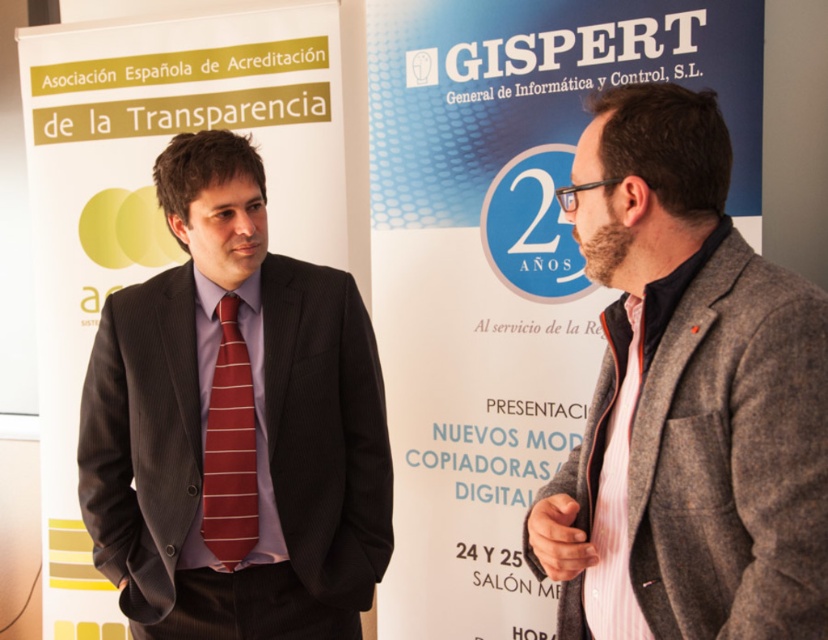
Is matte black suit at left below red striped tie at center?

Incorrect, matte black suit at left is not positioned below red striped tie at center.

Can you confirm if matte black suit at left is positioned above red striped tie at center?

Correct, matte black suit at left is located above red striped tie at center.

In order to click on matte black suit at left in this screenshot , I will do `click(234, 426)`.

Where is `matte black suit at left`? The image size is (828, 640). matte black suit at left is located at coordinates (234, 426).

Does point (674, 577) lie behind point (243, 440)?

No, (674, 577) is in front of (243, 440).

Is gray woolen blazer at right bigger than red striped tie at center?

Indeed, gray woolen blazer at right has a larger size compared to red striped tie at center.

Is point (735, 300) farther from viewer compared to point (210, 486)?

No, it is in front of (210, 486).

I want to click on gray woolen blazer at right, so click(689, 394).

Looking at this image, does matte black suit at left have a larger size compared to pink striped tie at right?

Yes, matte black suit at left is bigger than pink striped tie at right.

Is the position of matte black suit at left less distant than that of pink striped tie at right?

No, it is behind pink striped tie at right.

What do you see at coordinates (234, 426) in the screenshot? The width and height of the screenshot is (828, 640). I see `matte black suit at left` at bounding box center [234, 426].

Locate an element on the screen. Image resolution: width=828 pixels, height=640 pixels. matte black suit at left is located at coordinates (234, 426).